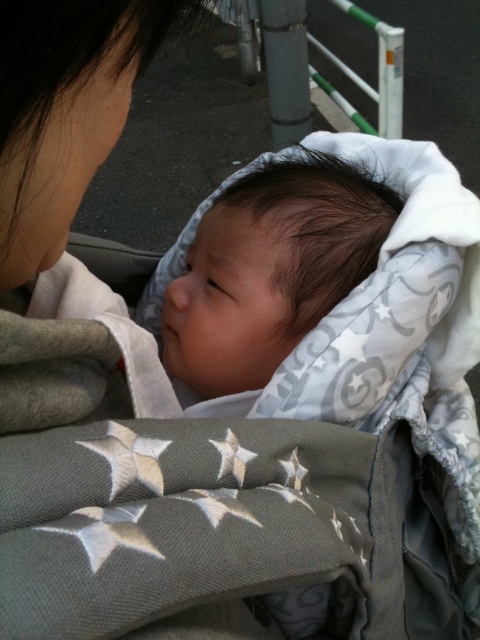
Which of these two, soft gray blanket at center or gray fabric at upper left, stands taller?

Standing taller between the two is soft gray blanket at center.

Consider the image. Does soft gray blanket at center come behind gray fabric at upper left?

Yes, it is behind gray fabric at upper left.

The image size is (480, 640). Find the location of `soft gray blanket at center`. soft gray blanket at center is located at coordinates (269, 269).